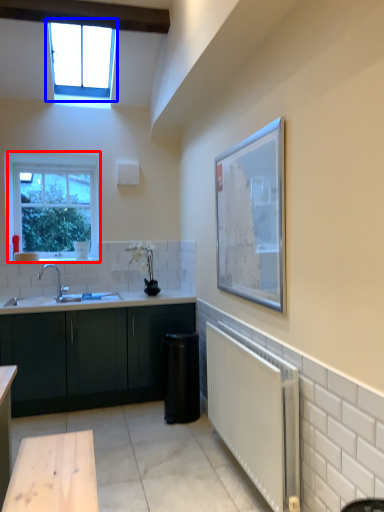
Question: Which point is further to the camera, window (highlighted by a red box) or window (highlighted by a blue box)?

Choices:
 (A) window
 (B) window

Answer: (A)